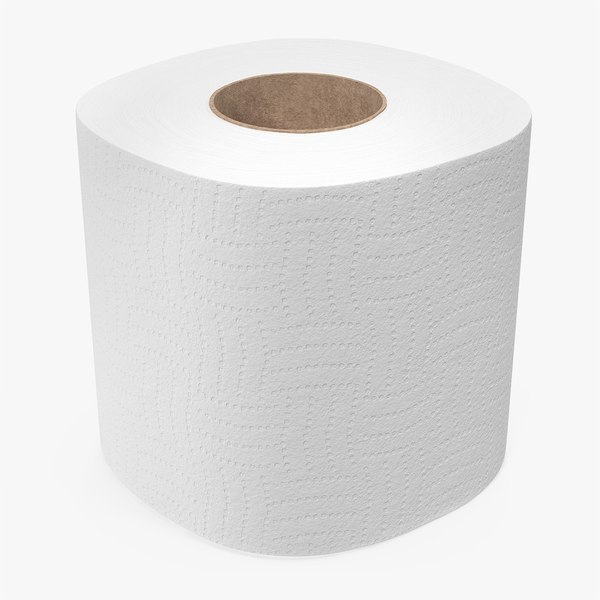
Identify the location of the front top of toilet paper roll. The width and height of the screenshot is (600, 600). (308, 163).